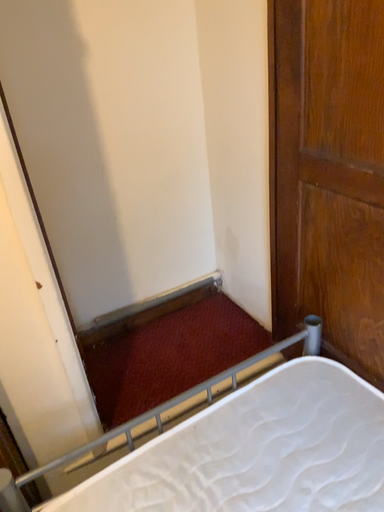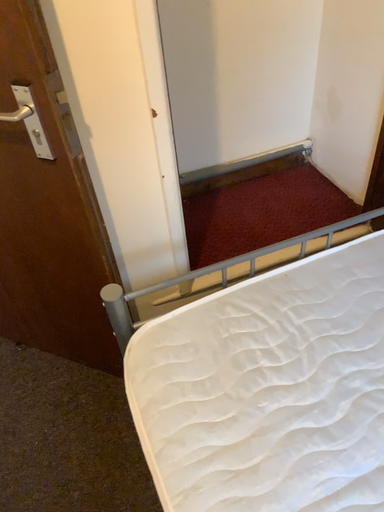
Question: Which way did the camera rotate in the video?

Choices:
 (A) rotated right
 (B) rotated left

Answer: (B)